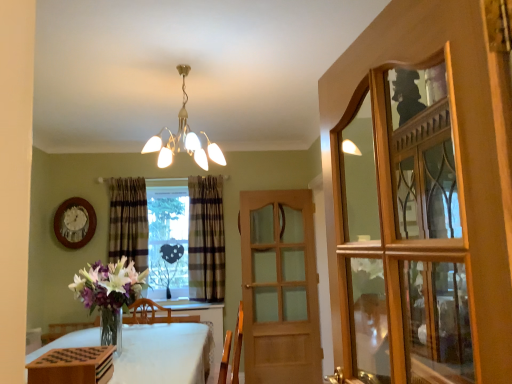
Question: From a real-world perspective, does white cloth-covered table at lower left sit lower than wooden glass cabinet at right?

Choices:
 (A) no
 (B) yes

Answer: (B)

Question: Can you confirm if white cloth-covered table at lower left is thinner than wooden glass cabinet at right?

Choices:
 (A) yes
 (B) no

Answer: (B)

Question: Could you tell me if white cloth-covered table at lower left is turned towards wooden glass cabinet at right?

Choices:
 (A) no
 (B) yes

Answer: (A)

Question: Is white cloth-covered table at lower left shorter than wooden glass cabinet at right?

Choices:
 (A) no
 (B) yes

Answer: (B)

Question: From the image's perspective, is white cloth-covered table at lower left on wooden glass cabinet at right?

Choices:
 (A) no
 (B) yes

Answer: (A)

Question: Are white cloth-covered table at lower left and wooden glass cabinet at right located far from each other?

Choices:
 (A) no
 (B) yes

Answer: (B)

Question: From the image's perspective, is light brown wooden door at center under clear glass heart at center?

Choices:
 (A) yes
 (B) no

Answer: (A)

Question: Considering the relative sizes of light brown wooden door at center and clear glass heart at center in the image provided, is light brown wooden door at center bigger than clear glass heart at center?

Choices:
 (A) yes
 (B) no

Answer: (A)

Question: Is light brown wooden door at center wider than clear glass heart at center?

Choices:
 (A) no
 (B) yes

Answer: (A)

Question: Can you confirm if light brown wooden door at center is shorter than clear glass heart at center?

Choices:
 (A) yes
 (B) no

Answer: (B)

Question: Is light brown wooden door at center not within clear glass heart at center?

Choices:
 (A) no
 (B) yes

Answer: (B)

Question: Is light brown wooden door at center in contact with clear glass heart at center?

Choices:
 (A) no
 (B) yes

Answer: (A)

Question: Is there a large distance between wooden glass cabinet at right and white cloth-covered table at lower left?

Choices:
 (A) no
 (B) yes

Answer: (B)